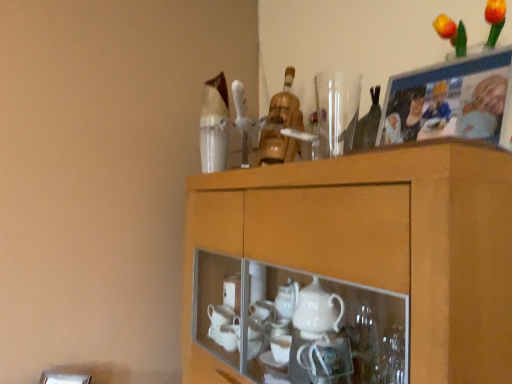
Question: Is wooden photo frame at upper right taller or shorter than wooden cabinet at upper center?

Choices:
 (A) short
 (B) tall

Answer: (A)

Question: From a real-world perspective, relative to wooden cabinet at upper center, is wooden photo frame at upper right vertically above or below?

Choices:
 (A) below
 (B) above

Answer: (B)

Question: Considering the real-world distances, which object is farthest from the wooden cabinet at upper center?

Choices:
 (A) transparent glass vase at upper center
 (B) wooden photo frame at upper right

Answer: (A)

Question: Which object is positioned closest to the wooden cabinet at upper center?

Choices:
 (A) wooden photo frame at upper right
 (B) transparent glass vase at upper center

Answer: (A)